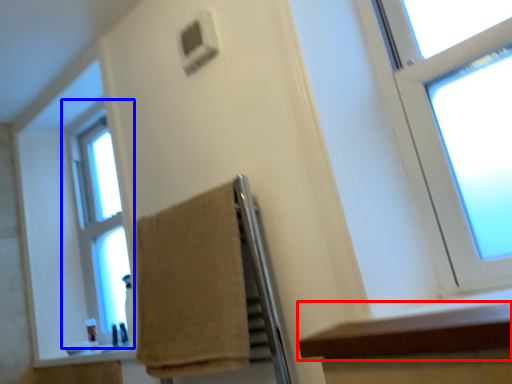
Question: Which object appears farthest to the camera in this image, ledge (highlighted by a red box) or window (highlighted by a blue box)?

Choices:
 (A) ledge
 (B) window

Answer: (B)